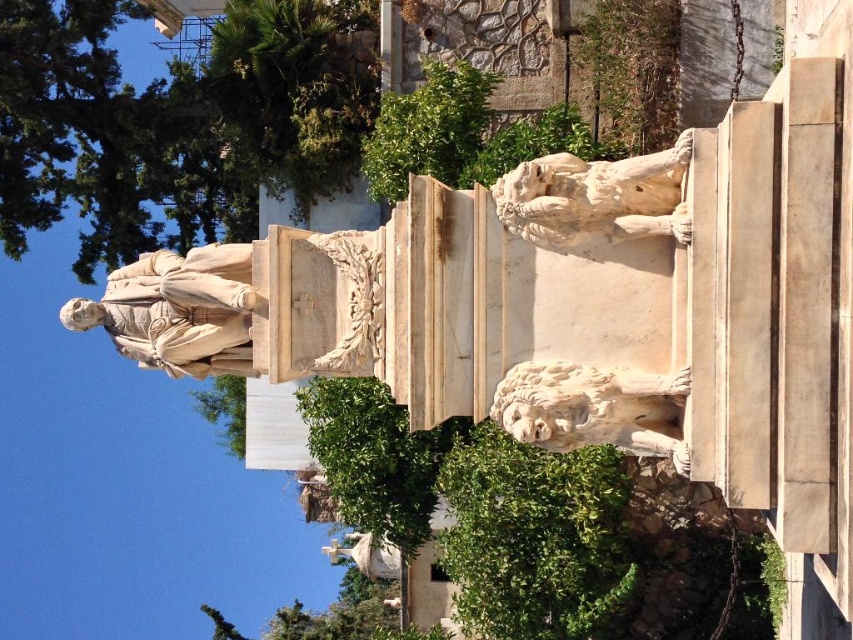
You are a landscape architect designing a garden around the monument. You need to ensure the white marble statue at center and the green leafy tree at center are visible from the main pathway. Given their positions, which one will be more visible from the pathway?

The white marble statue at center is positioned over the green leafy tree at center, so the statue will be more visible from the pathway as it is placed above the tree.

You are standing in front of the monument and want to place a small decorative item exactly at the center of the monument. Considering the green leafy bush at lower center, where should you place the item relative to it?

The green leafy bush at lower center is located at point (535, 538), so you should place the item at the center of the monument, which would be at coordinates (426, 320), to the left and above the green leafy bush at lower center.

You are an artist planning to sketch the monument. You need to decide which object to draw first based on their spatial relationship. Which one should you start with, the white marble statue at center or the green leafy tree at center?

You should start with the white marble statue at center because it occupies less space than the green leafy tree at center, making it easier to sketch first before tackling the larger tree.